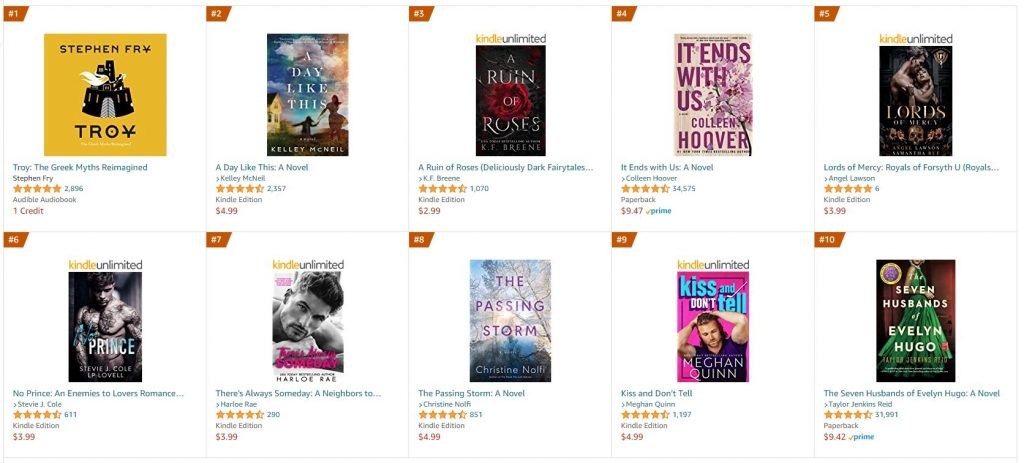
You are a GUI agent. You are given a task and a screenshot of the screen. Output one action in this format:
    pyautogui.click(x=<x>, y=<y>)
    Task: Click on the books
    
    Given the screenshot: What is the action you would take?
    [x=123, y=102], [x=288, y=97], [x=503, y=106], [x=731, y=106], [x=920, y=110], [x=899, y=285], [x=719, y=300], [x=535, y=296], [x=291, y=300]